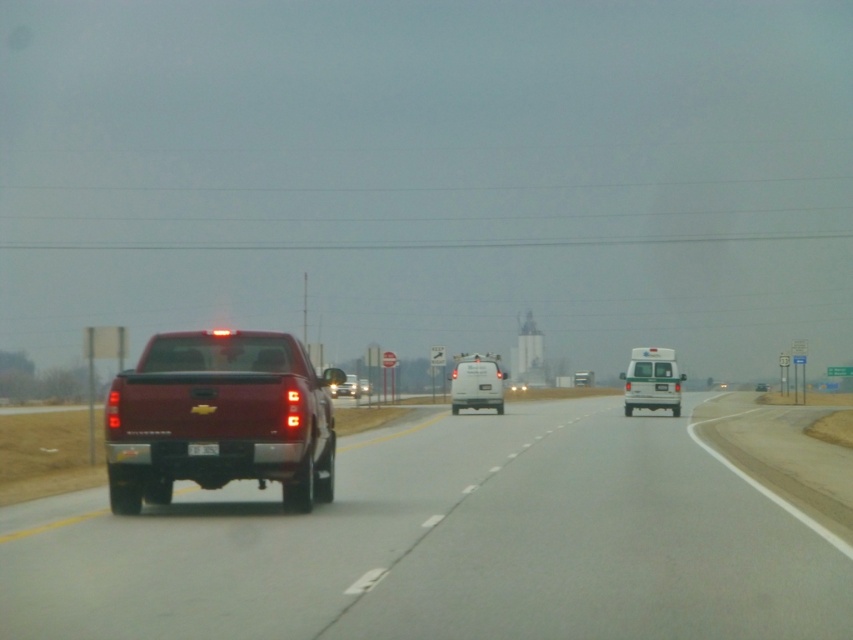
The width and height of the screenshot is (853, 640). Find the location of `metallic silver sedan at center`. metallic silver sedan at center is located at coordinates (347, 387).

Between point (224, 388) and point (473, 365), which one is positioned in front?

Point (224, 388)

Who is positioned more to the right, shiny red truck at left or white matte van at center?

white matte van at center

Which is in front, point (326, 378) or point (477, 396)?

Point (326, 378) is more forward.

Where is `shiny red truck at left`? Image resolution: width=853 pixels, height=640 pixels. shiny red truck at left is located at coordinates (219, 419).

Can you confirm if metallic red truck at left is positioned above metallic silver sedan at center?

Yes, metallic red truck at left is above metallic silver sedan at center.

Which of these two, metallic red truck at left or metallic silver sedan at center, stands shorter?

metallic red truck at left is shorter.

Describe the element at coordinates (444, 545) in the screenshot. I see `metallic red truck at left` at that location.

Where is `metallic red truck at left`? The height and width of the screenshot is (640, 853). metallic red truck at left is located at coordinates (444, 545).